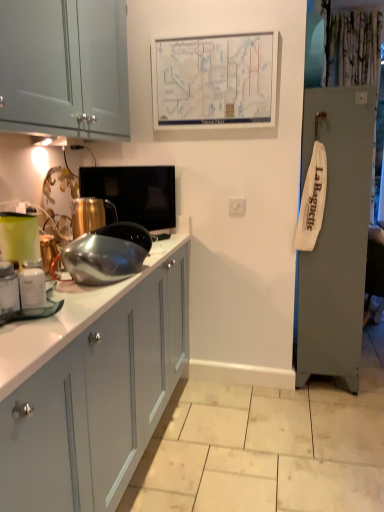
Question: Considering the relative sizes of shiny metallic bowl at center, which is the third appliance from back to front, and white glossy jar at left, the first appliance from the front, in the image provided, is shiny metallic bowl at center, which is the third appliance from back to front, taller than white glossy jar at left, the first appliance from the front,?

Choices:
 (A) yes
 (B) no

Answer: (A)

Question: Is shiny metallic bowl at center, which is counted as the 2th appliance, starting from the front, in front of white glossy jar at left, the fourth appliance from the back?

Choices:
 (A) yes
 (B) no

Answer: (B)

Question: From a real-world perspective, is shiny metallic bowl at center, which is counted as the 2th appliance, starting from the front, beneath white glossy jar at left, the first appliance from the front?

Choices:
 (A) no
 (B) yes

Answer: (A)

Question: Is shiny metallic bowl at center, which is counted as the 2th appliance, starting from the front, positioned with its back to white glossy jar at left, the first appliance from the front?

Choices:
 (A) yes
 (B) no

Answer: (B)

Question: From the image's perspective, is shiny metallic bowl at center, which is the third appliance from back to front, above white glossy jar at left, the first appliance from the front?

Choices:
 (A) no
 (B) yes

Answer: (B)

Question: Considering the positions of white matte electric outlet at center and white paper map at upper center in the image, is white matte electric outlet at center taller or shorter than white paper map at upper center?

Choices:
 (A) short
 (B) tall

Answer: (A)

Question: From a real-world perspective, is white matte electric outlet at center physically located above or below white paper map at upper center?

Choices:
 (A) above
 (B) below

Answer: (B)

Question: From the image's perspective, relative to white paper map at upper center, is white matte electric outlet at center above or below?

Choices:
 (A) below
 (B) above

Answer: (A)

Question: Does point (238, 206) appear closer or farther from the camera than point (264, 96)?

Choices:
 (A) farther
 (B) closer

Answer: (A)

Question: Relative to white paper map at upper center, is matte black tv at center, arranged as the fourth appliance when viewed from the front, in front or behind?

Choices:
 (A) front
 (B) behind

Answer: (A)

Question: Is matte black tv at center, positioned as the 1th appliance in back-to-front order, wider or thinner than white paper map at upper center?

Choices:
 (A) thin
 (B) wide

Answer: (B)

Question: From a real-world perspective, relative to white paper map at upper center, is matte black tv at center, positioned as the 1th appliance in back-to-front order, vertically above or below?

Choices:
 (A) above
 (B) below

Answer: (B)

Question: In the image, is matte black tv at center, positioned as the 1th appliance in back-to-front order, on the left side or the right side of white paper map at upper center?

Choices:
 (A) right
 (B) left

Answer: (B)

Question: Considering the positions of shiny metallic kettle at center-left, the 3th appliance from the front, and matte green plastic container at left in the image, is shiny metallic kettle at center-left, the 3th appliance from the front, wider or thinner than matte green plastic container at left?

Choices:
 (A) wide
 (B) thin

Answer: (A)

Question: In the image, is shiny metallic kettle at center-left, the 2th appliance when ordered from back to front, positioned in front of or behind matte green plastic container at left?

Choices:
 (A) behind
 (B) front

Answer: (A)